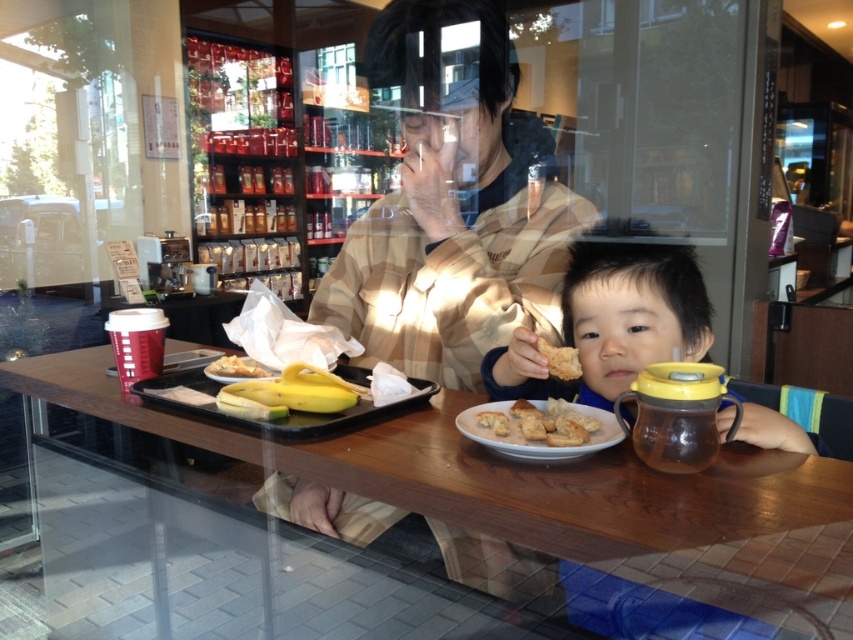
Question: Which point appears farthest from the camera in this image?

Choices:
 (A) (276, 422)
 (B) (167, 416)

Answer: (B)

Question: Can you confirm if smooth brown hair at center is positioned above golden brown croutons at center?

Choices:
 (A) no
 (B) yes

Answer: (B)

Question: Which object appears farthest from the camera in this image?

Choices:
 (A) wooden table at center
 (B) smooth brown hair at center
 (C) light brown plaid shirt at center
 (D) golden brown croutons at center

Answer: (C)

Question: Among these points, which one is nearest to the camera?

Choices:
 (A) (260, 406)
 (B) (546, 406)
 (C) (277, 419)
 (D) (689, 525)

Answer: (D)

Question: Can you confirm if light brown plaid shirt at center is thinner than black plastic tray at center?

Choices:
 (A) no
 (B) yes

Answer: (A)

Question: In this image, where is light brown plaid shirt at center located relative to white crumbly bread at left?

Choices:
 (A) left
 (B) right

Answer: (B)